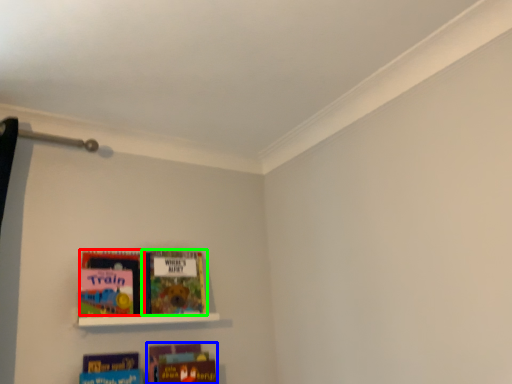
Question: Considering the real-world distances, which object is farthest from book (highlighted by a red box)? book (highlighted by a blue box) or book (highlighted by a green box)?

Choices:
 (A) book
 (B) book

Answer: (A)